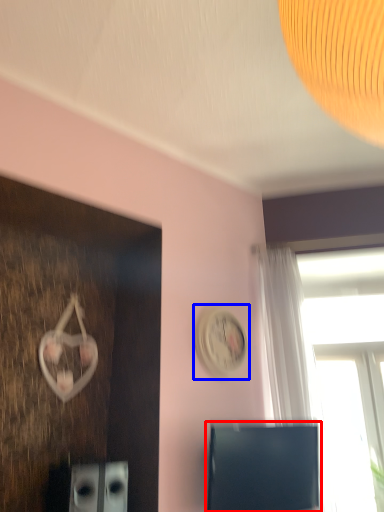
Question: Which of the following is the farthest to the observer, computer monitor (highlighted by a red box) or clock (highlighted by a blue box)?

Choices:
 (A) computer monitor
 (B) clock

Answer: (B)